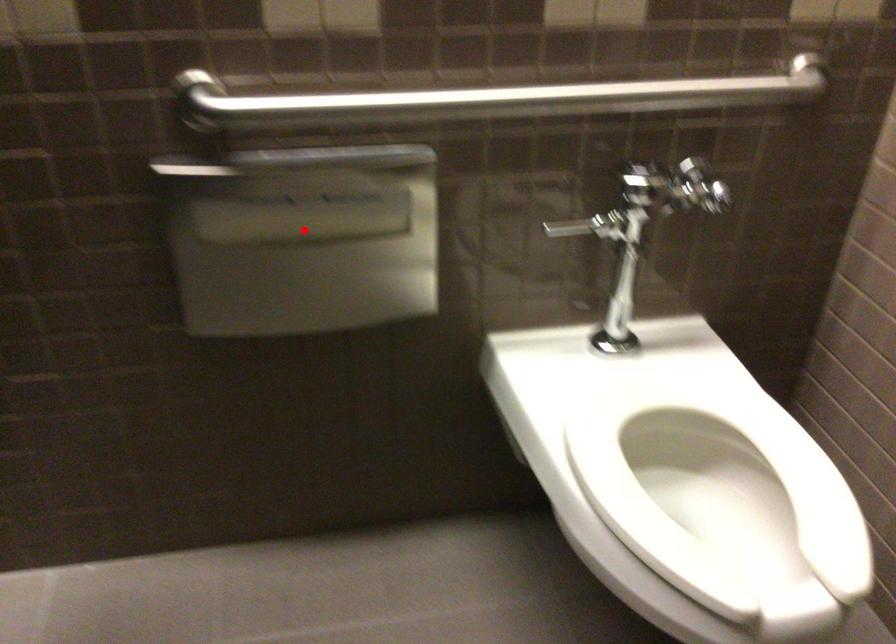
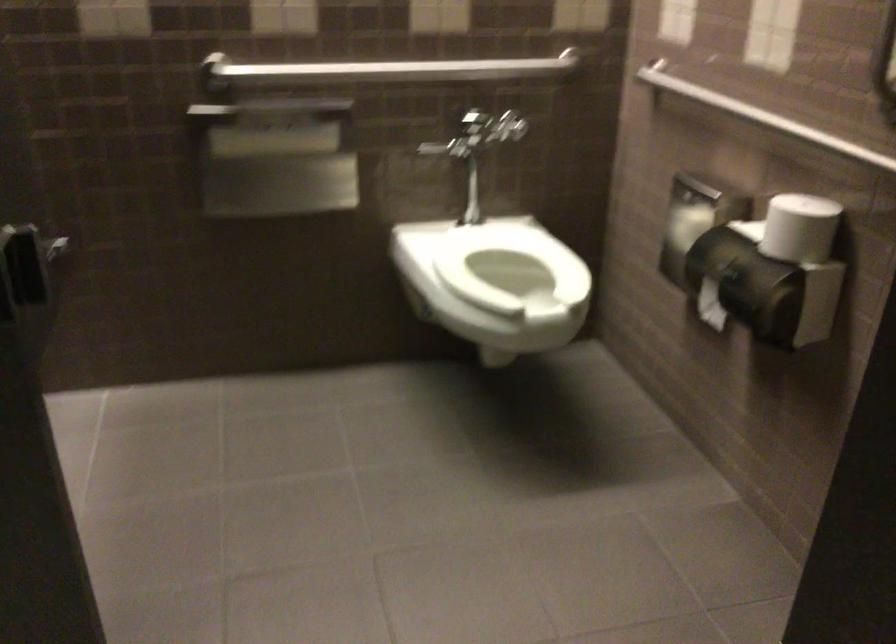
Locate, in the second image, the point that corresponds to the highlighted location in the first image.

(273, 143)